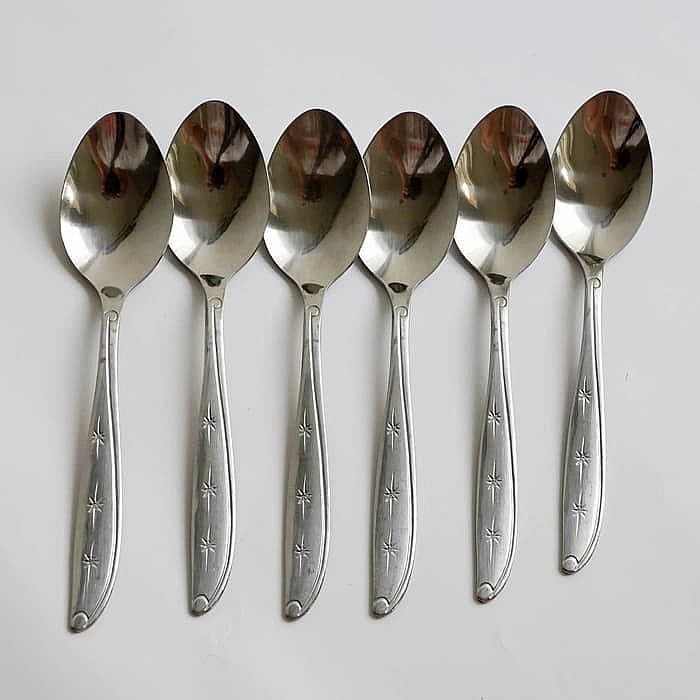
This screenshot has width=700, height=700. I want to click on spoon, so click(x=102, y=220), click(x=217, y=201), click(x=302, y=190), click(x=410, y=190), click(x=514, y=190), click(x=595, y=186).